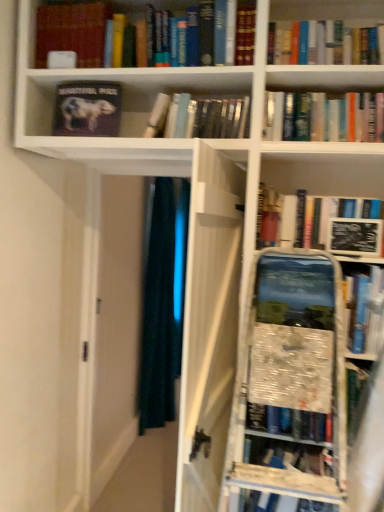
Identify the location of matte black book at upper left, the 2th book positioned from the left. The height and width of the screenshot is (512, 384). (87, 109).

Image resolution: width=384 pixels, height=512 pixels. Describe the element at coordinates (87, 109) in the screenshot. I see `matte black book at upper left, the 2th book positioned from the left` at that location.

This screenshot has width=384, height=512. Describe the element at coordinates (163, 304) in the screenshot. I see `dark blue fabric at center` at that location.

What do you see at coordinates (355, 237) in the screenshot? The image size is (384, 512). I see `black matte book at upper right` at bounding box center [355, 237].

How much space does matte black book at upper left, arranged as the 1th book when viewed from the left, occupy horizontally?

7.72 inches.

Locate an element on the screen. This screenshot has height=512, width=384. matte black book at upper left, the 2th book positioned from the left is located at coordinates (87, 109).

Is hardcover book at upper center, which is counted as the 1th book, starting from the right, facing away from black matte book at upper right?

hardcover book at upper center, which is counted as the 1th book, starting from the right, is not turned away from black matte book at upper right.

Is hardcover book at upper center, which is counted as the 1th book, starting from the right, inside the boundaries of black matte book at upper right, or outside?

hardcover book at upper center, which is counted as the 1th book, starting from the right, is not inside black matte book at upper right, it's outside.

How distant is hardcover book at upper center, the fourth book from the left, from black matte book at upper right?

25.92 inches.

Between hardcover book at upper center, the fourth book from the left, and black matte book at upper right, which one has more height?

hardcover book at upper center, the fourth book from the left, is taller.

From the image's perspective, count 2nd books upward from the black matte book at upper right and point to it. Please provide its 2D coordinates.

[(87, 109)]

Is black matte book at upper right positioned in front of matte black book at upper left, acting as the third book starting from the right?

Yes, it is in front of matte black book at upper left, acting as the third book starting from the right.

Who is taller, black matte book at upper right or matte black book at upper left, acting as the third book starting from the right?

matte black book at upper left, acting as the third book starting from the right.

Can you confirm if matte black book at upper left, the 2th book positioned from the left, is positioned to the left of hardcover book at upper center, the fourth book from the left?

Yes, matte black book at upper left, the 2th book positioned from the left, is to the left of hardcover book at upper center, the fourth book from the left.

Does matte black book at upper left, the 2th book positioned from the left, turn towards hardcover book at upper center, which is counted as the 1th book, starting from the right?

No.

Considering the relative sizes of matte black book at upper left, acting as the third book starting from the right, and hardcover book at upper center, which is counted as the 1th book, starting from the right, in the image provided, is matte black book at upper left, acting as the third book starting from the right, bigger than hardcover book at upper center, which is counted as the 1th book, starting from the right,?

Actually, matte black book at upper left, acting as the third book starting from the right, might be smaller than hardcover book at upper center, which is counted as the 1th book, starting from the right.

From the image's perspective, is black matte book at upper right above hardcover book at upper center, which is counted as the 1th book, starting from the right?

No.

Which is behind, point (369, 240) or point (294, 29)?

The point (294, 29) is behind.

Is black matte book at upper right facing away from hardcover book at upper center, which is counted as the 1th book, starting from the right?

No, black matte book at upper right's orientation is not away from hardcover book at upper center, which is counted as the 1th book, starting from the right.

Which object is more forward, black matte book at upper right or hardcover book at upper center, the fourth book from the left?

Positioned in front is hardcover book at upper center, the fourth book from the left.

Between hardcover book at center, the 3th book from the left, and hardcover book at upper center, which is counted as the 1th book, starting from the right, which one has less height?

With less height is hardcover book at center, the 3th book from the left.

Could you measure the distance between hardcover book at center, which appears as the 2th book when viewed from the right, and hardcover book at upper center, which is counted as the 1th book, starting from the right?

A distance of 11.16 inches exists between hardcover book at center, which appears as the 2th book when viewed from the right, and hardcover book at upper center, which is counted as the 1th book, starting from the right.

Is hardcover book at center, which appears as the 2th book when viewed from the right, closer to camera compared to hardcover book at upper center, which is counted as the 1th book, starting from the right?

No, hardcover book at center, which appears as the 2th book when viewed from the right, is behind hardcover book at upper center, which is counted as the 1th book, starting from the right.

Who is bigger, hardcover book at center, which appears as the 2th book when viewed from the right, or hardcover book at upper center, which is counted as the 1th book, starting from the right?

hardcover book at upper center, which is counted as the 1th book, starting from the right.

Considering the sizes of objects black matte book at upper right and hardcover book at center, the 3th book from the left, in the image provided, who is shorter, black matte book at upper right or hardcover book at center, the 3th book from the left,?

Standing shorter between the two is black matte book at upper right.

Identify the location of the 2nd book behind the black matte book at upper right, counting from the anchor's position. This screenshot has width=384, height=512. (219, 118).

Can you confirm if black matte book at upper right is smaller than hardcover book at center, the 3th book from the left?

Yes, black matte book at upper right is smaller than hardcover book at center, the 3th book from the left.

From a real-world perspective, does black matte book at upper right sit lower than hardcover book at center, which appears as the 2th book when viewed from the right?

Correct, in the physical world, black matte book at upper right is lower than hardcover book at center, which appears as the 2th book when viewed from the right.

Considering the relative sizes of transparent glass door at center and black matte book at upper right in the image provided, is transparent glass door at center thinner than black matte book at upper right?

Incorrect, the width of transparent glass door at center is not less than that of black matte book at upper right.

Visually, is transparent glass door at center positioned to the left or to the right of black matte book at upper right?

Based on their positions, transparent glass door at center is located to the left of black matte book at upper right.

Does transparent glass door at center have a larger size compared to black matte book at upper right?

Yes, transparent glass door at center is bigger than black matte book at upper right.

What are the coordinates of `the 3rd book positioned above the black matte book at upper right (from a real-world perspective)` in the screenshot? It's located at (282, 42).

Starting from the black matte book at upper right, which book is the 3rd one to the left? Please provide its 2D coordinates.

[(87, 109)]

Consider the image. Considering their positions, is matte black book at upper left, acting as the third book starting from the right, positioned further to black matte book at upper right than hardcover book at upper center, the fourth book from the left?

Among the two, matte black book at upper left, acting as the third book starting from the right, is located further to black matte book at upper right.

Which object lies further to the anchor point transparent glass door at center, black matte book at upper right or matte black book at upper left, the 2th book positioned from the left?

black matte book at upper right is further to transparent glass door at center.

Based on their spatial positions, is dark blue fabric at center or transparent glass door at center closer to matte black book at upper left, acting as the third book starting from the right?

transparent glass door at center is closer to matte black book at upper left, acting as the third book starting from the right.

Estimate the real-world distances between objects in this image. Which object is further from transparent glass door at center, dark blue fabric at center or matte black book at upper left, the 2th book positioned from the left?

matte black book at upper left, the 2th book positioned from the left.

Estimate the real-world distances between objects in this image. Which object is closer to matte black book at upper left, arranged as the 4th book when viewed from the right, hardcover book at upper center, the fourth book from the left, or black matte book at upper right?

hardcover book at upper center, the fourth book from the left, is positioned closer to the anchor matte black book at upper left, arranged as the 4th book when viewed from the right.

Estimate the real-world distances between objects in this image. Which object is closer to black matte book at upper right, hardcover book at upper center, the fourth book from the left, or matte black book at upper left, acting as the third book starting from the right?

The object closer to black matte book at upper right is hardcover book at upper center, the fourth book from the left.

Based on their spatial positions, is black matte book at upper right or matte black book at upper left, arranged as the 4th book when viewed from the right, further from transparent glass door at center?

black matte book at upper right is positioned further to the anchor transparent glass door at center.

When comparing their distances from hardcover book at upper center, the fourth book from the left, does black matte book at upper right or matte black book at upper left, acting as the third book starting from the right, seem closer?

black matte book at upper right is positioned closer to the anchor hardcover book at upper center, the fourth book from the left.

You are a GUI agent. You are given a task and a screenshot of the screen. Output one action in this format:
    pyautogui.click(x=<x>, y=<y>)
    Task: Click on the book positioned between hardcover book at center, the 3th book from the left, and dark blue fabric at center from near to far
    This screenshot has width=384, height=512.
    Given the screenshot: What is the action you would take?
    pyautogui.click(x=87, y=109)

Where is `glass door located between hardcover book at center, the 3th book from the left, and dark blue fabric at center in the depth direction`? The image size is (384, 512). glass door located between hardcover book at center, the 3th book from the left, and dark blue fabric at center in the depth direction is located at coordinates (125, 373).

Find the location of a particular element. The width and height of the screenshot is (384, 512). glass door between hardcover book at upper center, which is counted as the 1th book, starting from the right, and dark blue fabric at center, along the z-axis is located at coordinates (125, 373).

You are a GUI agent. You are given a task and a screenshot of the screen. Output one action in this format:
    pyautogui.click(x=<x>, y=<y>)
    Task: Click on the paperback book between matte black book at upper left, arranged as the 1th book when viewed from the left, and transparent glass door at center in the up-down direction
    The image size is (384, 512).
    Given the screenshot: What is the action you would take?
    pyautogui.click(x=355, y=237)